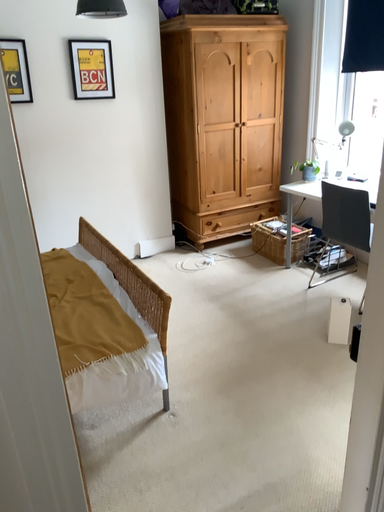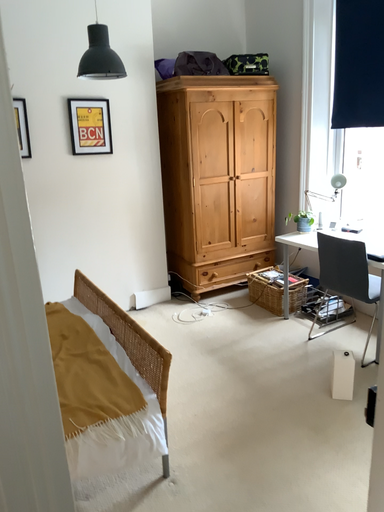
Question: How did the camera likely rotate when shooting the video?

Choices:
 (A) rotated upward
 (B) rotated downward

Answer: (A)